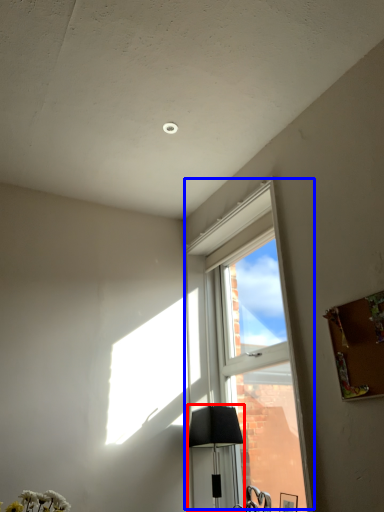
Question: Which of the following is the closest to the observer, lamp (highlighted by a red box) or window (highlighted by a blue box)?

Choices:
 (A) lamp
 (B) window

Answer: (B)